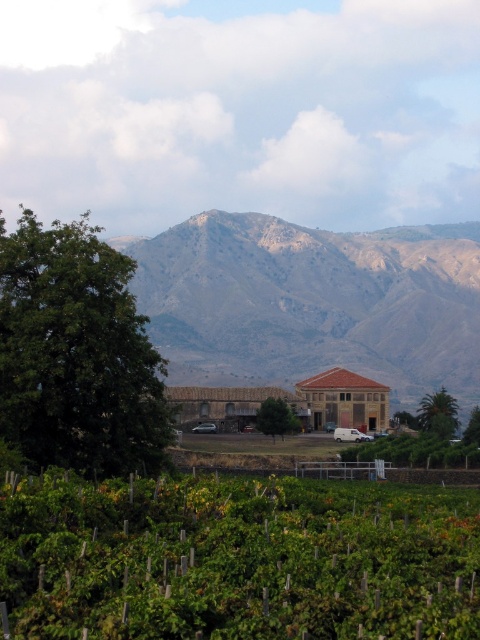
Between green leafy palm at right and green leafy tree at center, which one has less height?

With less height is green leafy palm at right.

Which is in front, point (445, 436) or point (268, 417)?

Positioned in front is point (268, 417).

What do you see at coordinates (439, 413) in the screenshot?
I see `green leafy palm at right` at bounding box center [439, 413].

Image resolution: width=480 pixels, height=640 pixels. I want to click on green leafy palm at right, so click(439, 413).

Does green leafy tree at center have a lesser width compared to green leafy tree at lower right?

Indeed, green leafy tree at center has a lesser width compared to green leafy tree at lower right.

Who is taller, green leafy tree at center or green leafy tree at lower right?

green leafy tree at center is taller.

Who is more distant from viewer, (276, 406) or (469, 432)?

Point (276, 406)

Identify the location of green leafy tree at center. (276, 417).

Which is more to the left, green leafy vineyard at lower center or green leafy tree at left?

From the viewer's perspective, green leafy tree at left appears more on the left side.

I want to click on green leafy vineyard at lower center, so click(x=237, y=561).

Where is `green leafy vineyard at lower center`? green leafy vineyard at lower center is located at coordinates (237, 561).